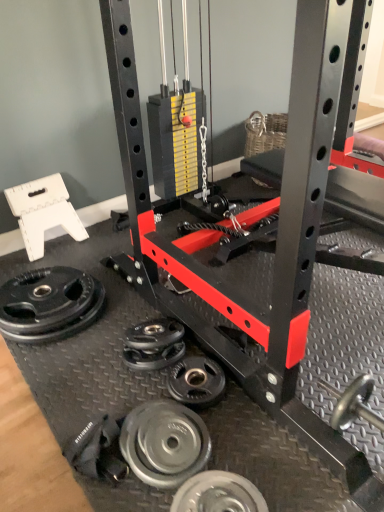
In order to face silver metallic weight plate at lower center, the 4th wheel positioned from the left, should I rotate leftwards or rightwards?

Rotate your view right by about 3.325°.

The image size is (384, 512). Describe the element at coordinates (49, 304) in the screenshot. I see `black rubber weight plate at lower left, which appears as the first wheel when viewed from the left` at that location.

Locate an element on the screen. silver metallic weight plate at lower center, marked as the third wheel in a bottom-to-top arrangement is located at coordinates (197, 382).

Can you tell me how much black rubber weight plate at lower left, which appears as the fourth wheel when viewed from the right, and silver metallic weight plate at lower center, the 4th wheel positioned from the left, differ in facing direction?

They differ by 0.366 degrees in their facing directions.

Is black rubber weight plate at lower left, which is the first wheel in back-to-front order, placed right next to silver metallic weight plate at lower center, the 4th wheel positioned from the left?

black rubber weight plate at lower left, which is the first wheel in back-to-front order, and silver metallic weight plate at lower center, the 4th wheel positioned from the left, are clearly separated.

Is black rubber weight plate at lower left, which ranks as the fourth wheel in front-to-back order, surrounding silver metallic weight plate at lower center, the 4th wheel positioned from the left?

Actually, silver metallic weight plate at lower center, the 4th wheel positioned from the left, is outside black rubber weight plate at lower left, which ranks as the fourth wheel in front-to-back order.

Considering the relative positions of black rubber weight plate at lower left, which appears as the first wheel when viewed from the left, and silver metallic weight plate at lower center, marked as the 1th wheel in a bottom-to-top arrangement, in the image provided, is black rubber weight plate at lower left, which appears as the first wheel when viewed from the left, to the right of silver metallic weight plate at lower center, marked as the 1th wheel in a bottom-to-top arrangement, from the viewer's perspective?

Incorrect, black rubber weight plate at lower left, which appears as the first wheel when viewed from the left, is not on the right side of silver metallic weight plate at lower center, marked as the 1th wheel in a bottom-to-top arrangement.

Which object is closer to the camera, silver metallic weight plate at lower center, which appears as the 4th wheel when viewed from the back, or black rubber weight plate at lower left, which ranks as the fourth wheel in front-to-back order?

silver metallic weight plate at lower center, which appears as the 4th wheel when viewed from the back.

From the picture: Considering the sizes of silver metallic weight plate at lower center, marked as the 1th wheel in a bottom-to-top arrangement, and black rubber weight plate at lower left, which ranks as the fourth wheel in front-to-back order, in the image, is silver metallic weight plate at lower center, marked as the 1th wheel in a bottom-to-top arrangement, wider or thinner than black rubber weight plate at lower left, which ranks as the fourth wheel in front-to-back order,?

Clearly, silver metallic weight plate at lower center, marked as the 1th wheel in a bottom-to-top arrangement, has less width compared to black rubber weight plate at lower left, which ranks as the fourth wheel in front-to-back order.

Can you tell me how much silver metallic weight plate at lower center, the fourth wheel in the top-to-bottom sequence, and black rubber weight plate at lower left, which appears as the first wheel when viewed from the left, differ in facing direction?

0.366 degrees separate the facing orientations of silver metallic weight plate at lower center, the fourth wheel in the top-to-bottom sequence, and black rubber weight plate at lower left, which appears as the first wheel when viewed from the left.

Could you tell me if silver metallic weight plate at lower center, which appears as the 1th wheel when viewed from the right, is turned towards black rubber weight plate at lower left, marked as the 1th wheel in a top-to-bottom arrangement?

No.

Are silver metallic weight plate at lower center, which ranks as the 2th wheel in back-to-front order, and silver metallic weight plate at lower center, the second wheel from the bottom, located far from each other?

That's not correct — silver metallic weight plate at lower center, which ranks as the 2th wheel in back-to-front order, is a little close to silver metallic weight plate at lower center, the second wheel from the bottom.

Between silver metallic weight plate at lower center, which ranks as the 2th wheel in back-to-front order, and silver metallic weight plate at lower center, arranged as the 3th wheel when viewed from the back, which one is positioned behind?

silver metallic weight plate at lower center, which ranks as the 2th wheel in back-to-front order, is further away from the camera.

Who is taller, silver metallic weight plate at lower center, the third wheel in the front-to-back sequence, or silver metallic weight plate at lower center, the second wheel from the bottom?

Standing taller between the two is silver metallic weight plate at lower center, the second wheel from the bottom.

Considering the sizes of silver metallic weight plate at lower center, the second wheel viewed from the top, and silver metallic weight plate at lower center, the 3th wheel when ordered from top to bottom, in the image, is silver metallic weight plate at lower center, the second wheel viewed from the top, wider or thinner than silver metallic weight plate at lower center, the 3th wheel when ordered from top to bottom,?

silver metallic weight plate at lower center, the second wheel viewed from the top, is wider than silver metallic weight plate at lower center, the 3th wheel when ordered from top to bottom.

Looking at this image, is silver metallic weight plate at lower center, the 4th wheel positioned from the left, positioned far away from silver metallic weight plate at lower center, the second wheel from the bottom?

No, there isn't a large distance between silver metallic weight plate at lower center, the 4th wheel positioned from the left, and silver metallic weight plate at lower center, the second wheel from the bottom.

Is silver metallic weight plate at lower center, marked as the 1th wheel in a bottom-to-top arrangement, to the left or to the right of silver metallic weight plate at lower center, which is counted as the third wheel, starting from the right, in the image?

Based on their positions, silver metallic weight plate at lower center, marked as the 1th wheel in a bottom-to-top arrangement, is located to the right of silver metallic weight plate at lower center, which is counted as the third wheel, starting from the right.

Which object is wider, silver metallic weight plate at lower center, which appears as the 1th wheel when viewed from the right, or silver metallic weight plate at lower center, which is counted as the 2th wheel, starting from the left?

silver metallic weight plate at lower center, which is counted as the 2th wheel, starting from the left, is wider.

From the image's perspective, is silver metallic weight plate at lower center, the 3th wheel when ordered from top to bottom, below silver metallic weight plate at lower center, marked as the third wheel in a bottom-to-top arrangement?

Indeed, from the image's perspective, silver metallic weight plate at lower center, the 3th wheel when ordered from top to bottom, is shown beneath silver metallic weight plate at lower center, marked as the third wheel in a bottom-to-top arrangement.

There is a silver metallic weight plate at lower center, the third wheel in the front-to-back sequence. At what (x,y) coordinates should I click in order to perform the action: click on the 1st wheel below it (from the image's perspective). Please return your answer as a coordinate pair (x, y). Image resolution: width=384 pixels, height=512 pixels. Looking at the image, I should click on (164, 443).

Considering the points (176, 426) and (185, 390), which point is behind, point (176, 426) or point (185, 390)?

The point (185, 390) is farther from the camera.

Which is more to the right, silver metallic weight plate at lower center, which is counted as the third wheel, starting from the right, or silver metallic weight plate at lower center, which appears as the 1th wheel when viewed from the right?

silver metallic weight plate at lower center, which appears as the 1th wheel when viewed from the right, is more to the right.

From a real-world perspective, is silver metallic weight plate at lower center, which is counted as the 2th wheel, starting from the left, located higher than silver metallic weight plate at lower center, the fourth wheel in the top-to-bottom sequence?

Indeed, from a real-world perspective, silver metallic weight plate at lower center, which is counted as the 2th wheel, starting from the left, stands above silver metallic weight plate at lower center, the fourth wheel in the top-to-bottom sequence.

Is silver metallic weight plate at lower center, which ranks as the second wheel in front-to-back order, positioned with its back to silver metallic weight plate at lower center, the fourth wheel in the top-to-bottom sequence?

silver metallic weight plate at lower center, which ranks as the second wheel in front-to-back order, does not have its back to silver metallic weight plate at lower center, the fourth wheel in the top-to-bottom sequence.

Which is in front, silver metallic weight plate at lower center, the second wheel from the bottom, or silver metallic weight plate at lower center, the fourth wheel in the top-to-bottom sequence?

silver metallic weight plate at lower center, the fourth wheel in the top-to-bottom sequence, is more forward.

You are a GUI agent. You are given a task and a screenshot of the screen. Output one action in this format:
    pyautogui.click(x=<x>, y=<y>)
    Task: Click on the wheel that appears above the silver metallic weight plate at lower center, the second wheel viewed from the top (from the image's perspective)
    Image resolution: width=384 pixels, height=512 pixels.
    Given the screenshot: What is the action you would take?
    pyautogui.click(x=49, y=304)

Looking at this image, could you measure the distance between silver metallic weight plate at lower center, the third wheel from the left, and black rubber weight plate at lower left, marked as the 1th wheel in a top-to-bottom arrangement?

silver metallic weight plate at lower center, the third wheel from the left, and black rubber weight plate at lower left, marked as the 1th wheel in a top-to-bottom arrangement, are 20.49 inches apart from each other.

From the image's perspective, is silver metallic weight plate at lower center, marked as the third wheel in a bottom-to-top arrangement, located beneath black rubber weight plate at lower left, which is the first wheel in back-to-front order?

Yes, from the image's perspective, silver metallic weight plate at lower center, marked as the third wheel in a bottom-to-top arrangement, is beneath black rubber weight plate at lower left, which is the first wheel in back-to-front order.

Is silver metallic weight plate at lower center, the third wheel from the left, next to black rubber weight plate at lower left, which is the first wheel in back-to-front order?

No, silver metallic weight plate at lower center, the third wheel from the left, is not with black rubber weight plate at lower left, which is the first wheel in back-to-front order.

From the image's perspective, count 3rd wheels downward from the black rubber weight plate at lower left, which appears as the first wheel when viewed from the left, and point to it. Please provide its 2D coordinates.

[(218, 494)]

Where is `the 3rd wheel to the left when counting from the silver metallic weight plate at lower center, the fourth wheel in the top-to-bottom sequence`? the 3rd wheel to the left when counting from the silver metallic weight plate at lower center, the fourth wheel in the top-to-bottom sequence is located at coordinates (49, 304).

Looking at the image, which one is located further to silver metallic weight plate at lower center, the third wheel in the front-to-back sequence, silver metallic weight plate at lower center, the second wheel from the bottom, or silver metallic weight plate at lower center, marked as the 1th wheel in a bottom-to-top arrangement?

Based on the image, silver metallic weight plate at lower center, marked as the 1th wheel in a bottom-to-top arrangement, appears to be further to silver metallic weight plate at lower center, the third wheel in the front-to-back sequence.

Based on their spatial positions, is silver metallic weight plate at lower center, which ranks as the 2th wheel in back-to-front order, or silver metallic weight plate at lower center, the 3th wheel when ordered from top to bottom, closer to black rubber weight plate at lower left, which appears as the first wheel when viewed from the left?

silver metallic weight plate at lower center, which ranks as the 2th wheel in back-to-front order.

Estimate the real-world distances between objects in this image. Which object is further from black rubber weight plate at lower left, which ranks as the fourth wheel in front-to-back order, silver metallic weight plate at lower center, marked as the 1th wheel in a bottom-to-top arrangement, or silver metallic weight plate at lower center, which is counted as the 2th wheel, starting from the left?

Among the two, silver metallic weight plate at lower center, marked as the 1th wheel in a bottom-to-top arrangement, is located further to black rubber weight plate at lower left, which ranks as the fourth wheel in front-to-back order.

Looking at this image, looking at the image, which one is located closer to silver metallic weight plate at lower center, marked as the third wheel in a bottom-to-top arrangement, silver metallic weight plate at lower center, the 4th wheel positioned from the left, or silver metallic weight plate at lower center, the 3th wheel when ordered from top to bottom?

Based on the image, silver metallic weight plate at lower center, the 3th wheel when ordered from top to bottom, appears to be nearer to silver metallic weight plate at lower center, marked as the third wheel in a bottom-to-top arrangement.

From the image, which object appears to be nearer to black rubber weight plate at lower left, which appears as the fourth wheel when viewed from the right, silver metallic weight plate at lower center, marked as the third wheel in a bottom-to-top arrangement, or silver metallic weight plate at lower center, which ranks as the first wheel in front-to-back order?

silver metallic weight plate at lower center, marked as the third wheel in a bottom-to-top arrangement, lies closer to black rubber weight plate at lower left, which appears as the fourth wheel when viewed from the right, than the other object.

From the picture: Looking at the image, which one is located further to black rubber weight plate at lower left, which appears as the first wheel when viewed from the left, silver metallic weight plate at lower center, which is counted as the third wheel, starting from the right, or silver metallic weight plate at lower center, which appears as the 1th wheel when viewed from the right?

silver metallic weight plate at lower center, which appears as the 1th wheel when viewed from the right.

From the image, which object appears to be farther from silver metallic weight plate at lower center, the third wheel from the left, silver metallic weight plate at lower center, which ranks as the first wheel in front-to-back order, or black rubber weight plate at lower left, which appears as the fourth wheel when viewed from the right?

black rubber weight plate at lower left, which appears as the fourth wheel when viewed from the right, lies further to silver metallic weight plate at lower center, the third wheel from the left, than the other object.

Based on their spatial positions, is silver metallic weight plate at lower center, the second wheel from the bottom, or silver metallic weight plate at lower center, acting as the 2th wheel starting from the right, closer to black rubber weight plate at lower left, which ranks as the fourth wheel in front-to-back order?

The object closer to black rubber weight plate at lower left, which ranks as the fourth wheel in front-to-back order, is silver metallic weight plate at lower center, acting as the 2th wheel starting from the right.

At what (x,y) coordinates should I click in order to perform the action: click on wheel between black rubber weight plate at lower left, which appears as the first wheel when viewed from the left, and silver metallic weight plate at lower center, marked as the third wheel in a bottom-to-top arrangement, from left to right. Please return your answer as a coordinate pair (x, y). Looking at the image, I should click on (164, 443).

Where is `wheel located between silver metallic weight plate at lower center, the 4th wheel positioned from the left, and silver metallic weight plate at lower center, the third wheel in the front-to-back sequence, in the depth direction`? This screenshot has height=512, width=384. wheel located between silver metallic weight plate at lower center, the 4th wheel positioned from the left, and silver metallic weight plate at lower center, the third wheel in the front-to-back sequence, in the depth direction is located at coordinates (164, 443).